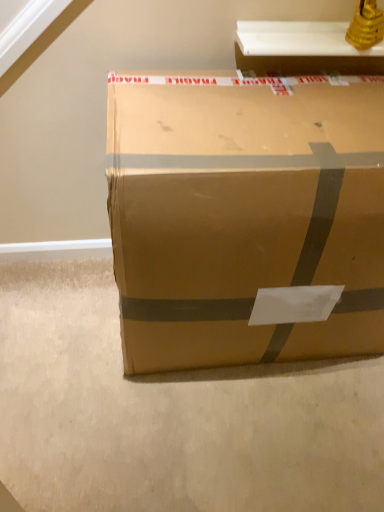
Locate an element on the screen. This screenshot has height=512, width=384. free space on the front side of brown cardboard box at center is located at coordinates (235, 436).